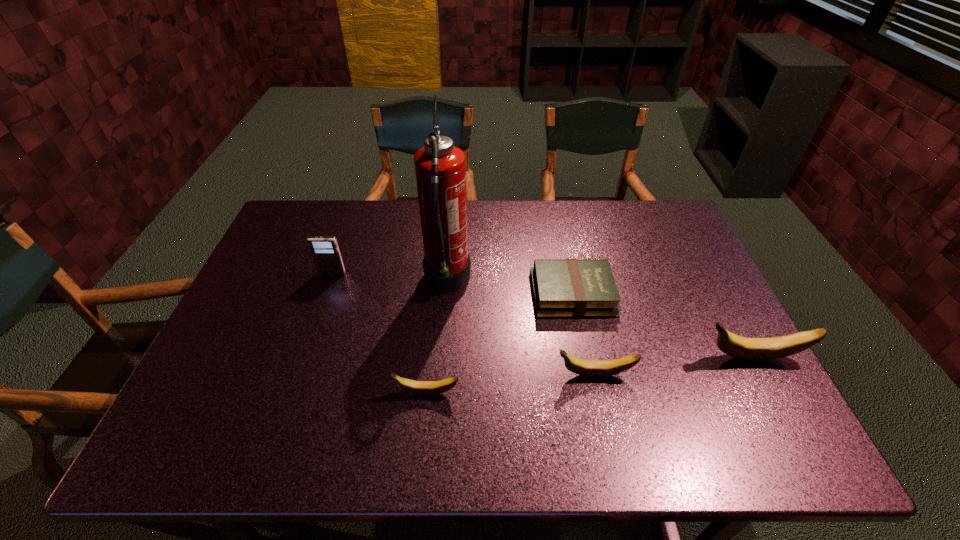
Find the location of a particular element. This screenshot has height=540, width=960. the leftmost banana is located at coordinates (416, 387).

You are a GUI agent. You are given a task and a screenshot of the screen. Output one action in this format:
    pyautogui.click(x=<x>, y=<y>)
    Task: Click on the second shortest object
    
    Given the screenshot: What is the action you would take?
    pyautogui.click(x=416, y=387)

Find the location of `the second tallest banana`. the second tallest banana is located at coordinates (590, 368).

Identify the location of the second nearest banana. The width and height of the screenshot is (960, 540). (590, 368).

Where is `the third nearest object`? the third nearest object is located at coordinates (750, 349).

This screenshot has height=540, width=960. I want to click on the tallest banana, so [x=750, y=349].

Identify the location of the leftmost object. This screenshot has height=540, width=960. (325, 250).

You are a GUI agent. You are given a task and a screenshot of the screen. Output one action in this format:
    pyautogui.click(x=<x>, y=<y>)
    Task: Click on the tallest object
    The height and width of the screenshot is (540, 960).
    Given the screenshot: What is the action you would take?
    click(x=440, y=168)

You are a GUI agent. You are given a task and a screenshot of the screen. Output one action in this format:
    pyautogui.click(x=<x>, y=<y>)
    Task: Click on the book
    This screenshot has height=540, width=960.
    Given the screenshot: What is the action you would take?
    pyautogui.click(x=562, y=288)

You are a GUI agent. You are given a task and a screenshot of the screen. Output one action in this format:
    pyautogui.click(x=<x>, y=<y>)
    Task: Click on the free space located at the stem of the nearest banana
    This screenshot has width=960, height=540.
    Given the screenshot: What is the action you would take?
    pyautogui.click(x=252, y=393)